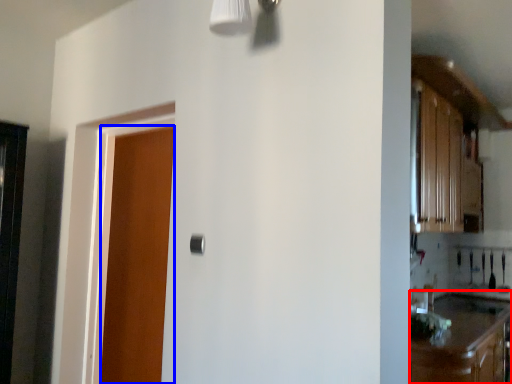
Question: Which object is closer to the camera taking this photo, cabinetry (highlighted by a red box) or door (highlighted by a blue box)?

Choices:
 (A) cabinetry
 (B) door

Answer: (A)